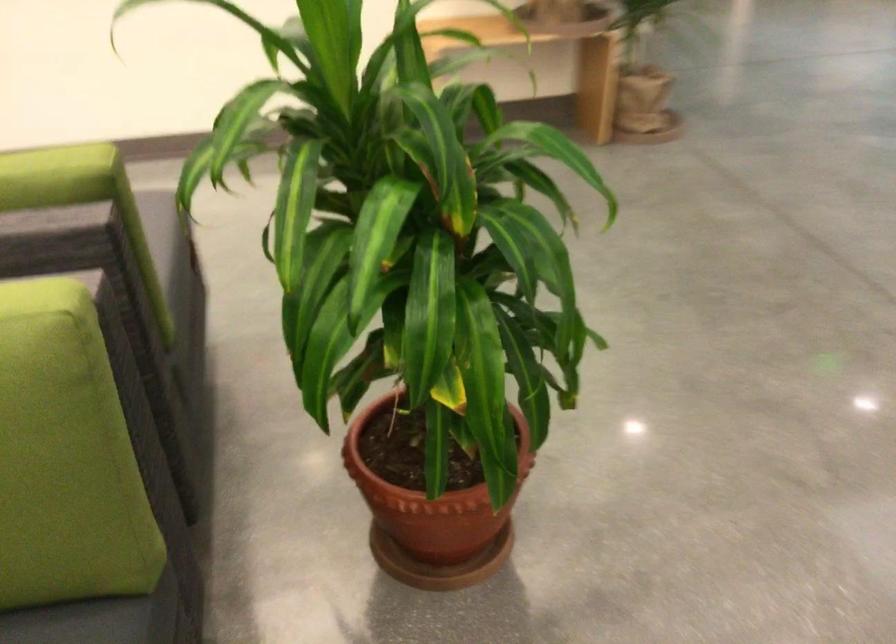
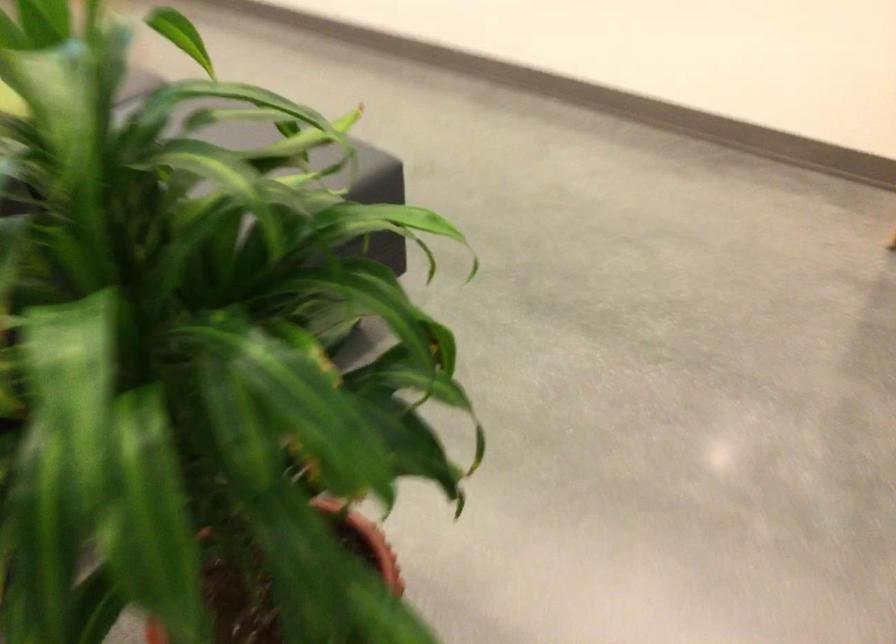
Find the pixel in the second image that matches the point at 562,285 in the first image.

(325, 558)